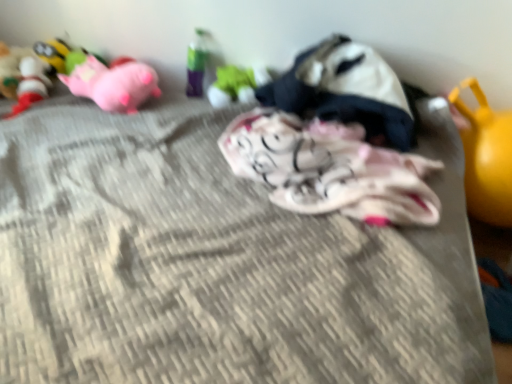
Question: Which direction should I rotate to look at green matte toy at center, positioned as the fourth toy in right-to-left order, — up or down?

Choices:
 (A) down
 (B) up

Answer: (B)

Question: Does yellow rubber ball at right, the 1th toy viewed from the right, have a lesser height compared to matte pink plush at upper left, which ranks as the 1th toy in left-to-right order?

Choices:
 (A) no
 (B) yes

Answer: (A)

Question: Is yellow rubber ball at right, the 1th toy viewed from the right, positioned with its back to matte pink plush at upper left, which appears as the 8th toy when viewed from the right?

Choices:
 (A) yes
 (B) no

Answer: (B)

Question: Is yellow rubber ball at right, marked as the 8th toy in a left-to-right arrangement, not near matte pink plush at upper left, which appears as the 8th toy when viewed from the right?

Choices:
 (A) yes
 (B) no

Answer: (A)

Question: From the image's perspective, is yellow rubber ball at right, marked as the 8th toy in a left-to-right arrangement, located above matte pink plush at upper left, which ranks as the 1th toy in left-to-right order?

Choices:
 (A) yes
 (B) no

Answer: (B)

Question: Considering the relative sizes of yellow rubber ball at right, marked as the 8th toy in a left-to-right arrangement, and matte pink plush at upper left, which ranks as the 1th toy in left-to-right order, in the image provided, is yellow rubber ball at right, marked as the 8th toy in a left-to-right arrangement, thinner than matte pink plush at upper left, which ranks as the 1th toy in left-to-right order,?

Choices:
 (A) no
 (B) yes

Answer: (B)

Question: Is yellow rubber ball at right, marked as the 8th toy in a left-to-right arrangement, in contact with matte pink plush at upper left, which appears as the 8th toy when viewed from the right?

Choices:
 (A) no
 (B) yes

Answer: (A)

Question: Is pink plush pig at upper left, the sixth toy when ordered from right to left, further to camera compared to fluffy white blanket at center, placed as the third toy when sorted from right to left?

Choices:
 (A) no
 (B) yes

Answer: (B)

Question: Would you consider pink plush pig at upper left, acting as the third toy starting from the left, to be distant from fluffy white blanket at center, placed as the third toy when sorted from right to left?

Choices:
 (A) no
 (B) yes

Answer: (A)

Question: Is pink plush pig at upper left, acting as the third toy starting from the left, to the left of fluffy white blanket at center, which is the 6th toy in left-to-right order, from the viewer's perspective?

Choices:
 (A) no
 (B) yes

Answer: (B)

Question: Can you confirm if pink plush pig at upper left, the sixth toy when ordered from right to left, is bigger than fluffy white blanket at center, which is the 6th toy in left-to-right order?

Choices:
 (A) yes
 (B) no

Answer: (B)

Question: From the image's perspective, is pink plush pig at upper left, acting as the third toy starting from the left, over fluffy white blanket at center, which is the 6th toy in left-to-right order?

Choices:
 (A) no
 (B) yes

Answer: (B)

Question: Could you tell me if pink plush pig at upper left, acting as the third toy starting from the left, is turned towards fluffy white blanket at center, which is the 6th toy in left-to-right order?

Choices:
 (A) no
 (B) yes

Answer: (A)

Question: Is translucent plastic bottle at upper center, which is the fourth toy from left to right, located outside pink plush pig at upper left, the sixth toy when ordered from right to left?

Choices:
 (A) yes
 (B) no

Answer: (A)